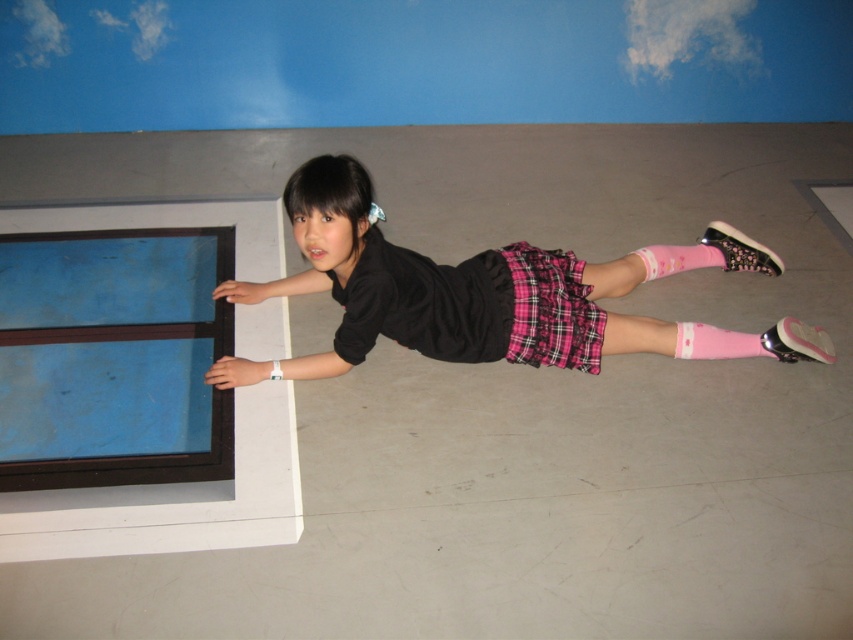
Question: Which of the following is the closest to the observer?

Choices:
 (A) (357, 195)
 (B) (691, 342)
 (C) (509, 314)
 (D) (686, 248)

Answer: (A)

Question: Which of the following is the farthest from the observer?

Choices:
 (A) pink matte sock at lower right
 (B) black matte shirt at center
 (C) pink matte sock at lower center

Answer: (C)

Question: Is plaid fabric skirt at center smaller than pink matte sock at lower right?

Choices:
 (A) yes
 (B) no

Answer: (B)

Question: Is black matte shirt at center thinner than pink matte sock at lower right?

Choices:
 (A) yes
 (B) no

Answer: (B)

Question: Which object is farther from the camera taking this photo?

Choices:
 (A) pink matte sock at lower right
 (B) plaid fabric skirt at center

Answer: (A)

Question: Does black matte shirt at center have a larger size compared to pink matte sock at lower right?

Choices:
 (A) yes
 (B) no

Answer: (A)